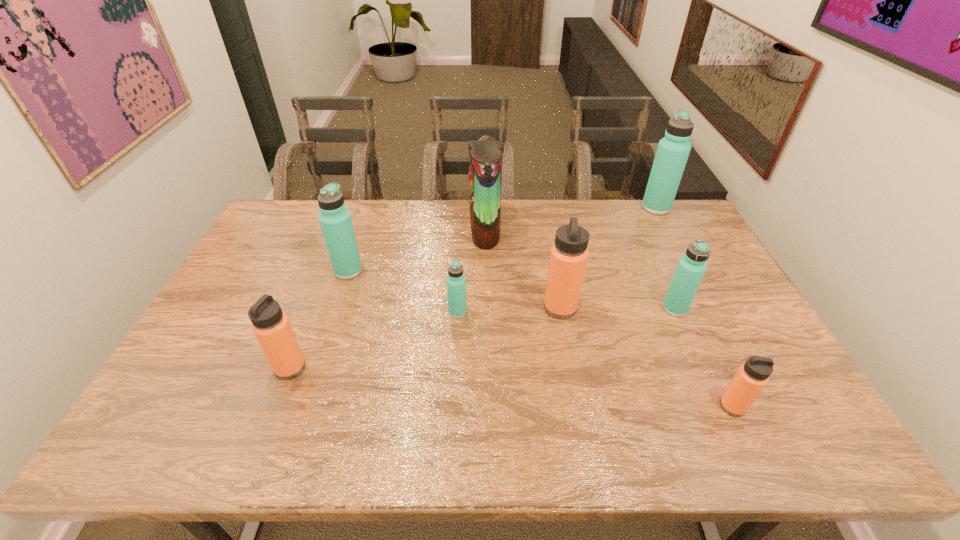
Locate an element on the screen. This screenshot has width=960, height=540. vacant point located between the nearest object and the leftmost aqua thermos bottle is located at coordinates (540, 339).

In order to click on the sixth closest object relative to the sixth farthest thermos bottle in this screenshot , I will do `click(752, 376)`.

At what (x,y) coordinates should I click in order to perform the action: click on object that ranks as the closest to the rightmost aqua thermos bottle. Please return your answer as a coordinate pair (x, y). The height and width of the screenshot is (540, 960). Looking at the image, I should click on (691, 267).

Select which thermos bottle appears as the fifth closest to the second nearest orange thermos bottle. Please provide its 2D coordinates. Your answer should be formatted as a tuple, i.e. [(x, y)], where the tuple contains the x and y coordinates of a point satisfying the conditions above.

[(752, 376)]

The height and width of the screenshot is (540, 960). I want to click on the third closest thermos bottle to the parrot, so click(335, 220).

Select which aqua thermos bottle is the fourth closest to the parrot. Please provide its 2D coordinates. Your answer should be formatted as a tuple, i.e. [(x, y)], where the tuple contains the x and y coordinates of a point satisfying the conditions above.

[(673, 150)]

Find the location of a particular element. aqua thermos bottle that stands as the fourth closest to the sixth farthest thermos bottle is located at coordinates (673, 150).

Locate which orange thermos bottle is the third closest to the parrot. Please provide its 2D coordinates. Your answer should be formatted as a tuple, i.e. [(x, y)], where the tuple contains the x and y coordinates of a point satisfying the conditions above.

[(752, 376)]

Image resolution: width=960 pixels, height=540 pixels. I want to click on orange thermos bottle that is the second closest to the second orange thermos bottle from left to right, so click(x=271, y=327).

Locate an element on the screen. free location that satisfies the following two spatial constraints: 1. on the front side of the sixth nearest thermos bottle; 2. on the left side of the second aqua thermos bottle from right to left is located at coordinates (336, 308).